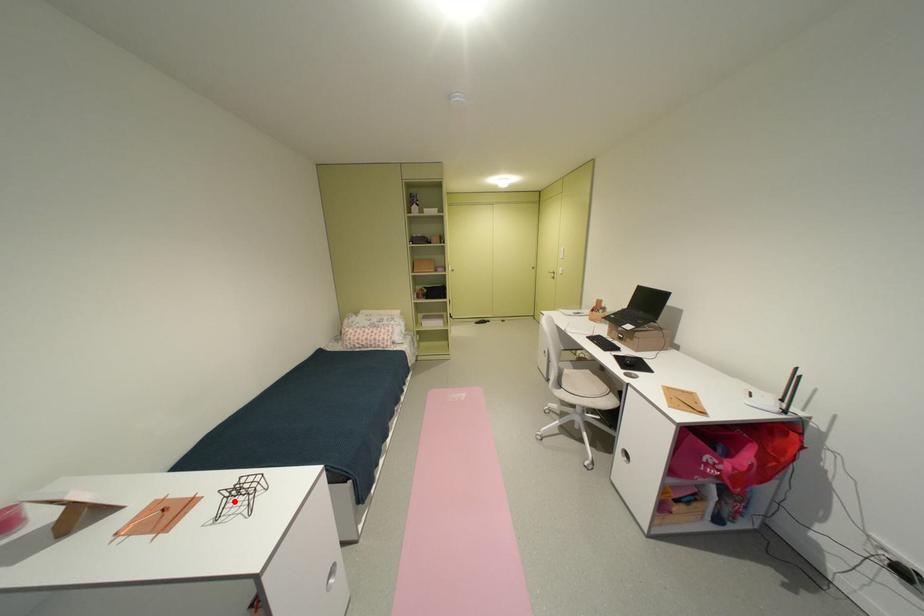
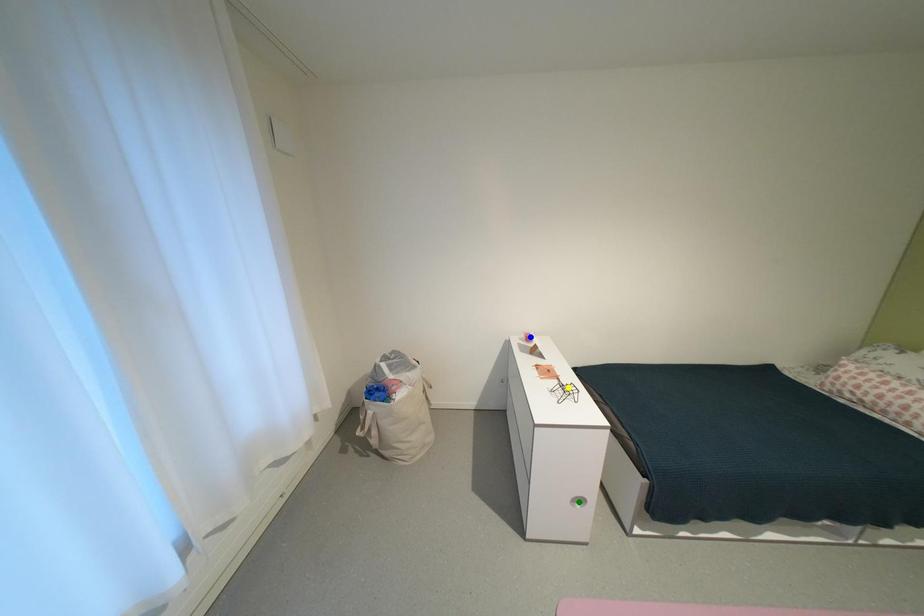
Question: I am providing you with two images of the same scene from different viewpoints. A red point is marked on the first image. You are given multiple points on the second image. Which spot in image 2 lines up with the point in image 1?

Choices:
 (A) green point
 (B) yellow point
 (C) blue point

Answer: (B)